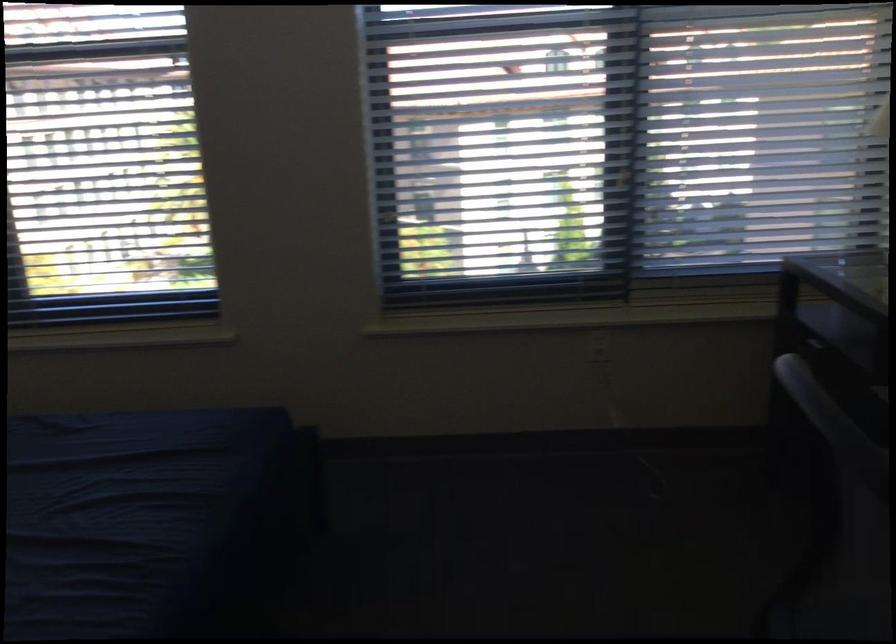
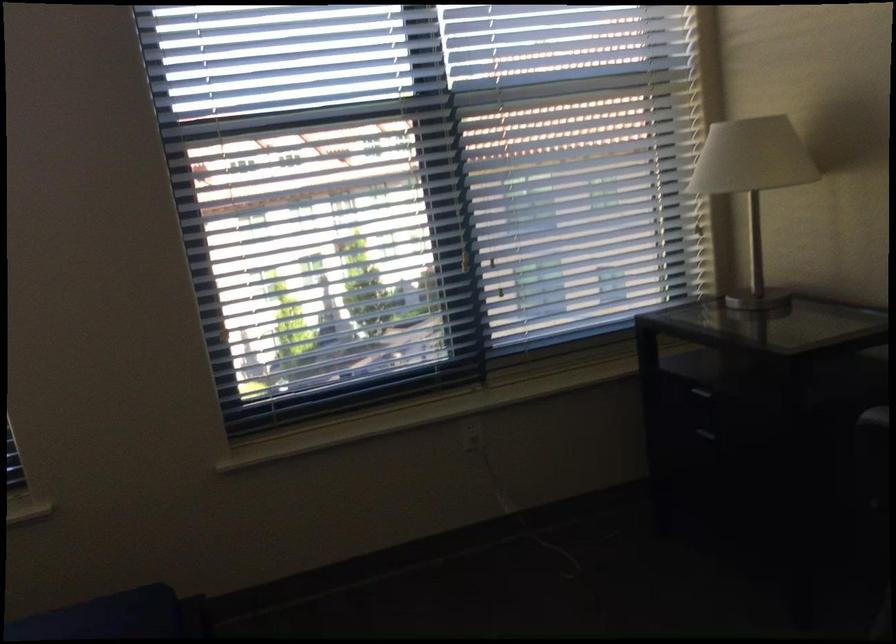
Question: The images are taken continuously from a first-person perspective. In which direction is your viewpoint rotating?

Choices:
 (A) Left
 (B) Right
 (C) Up
 (D) Down

Answer: (B)